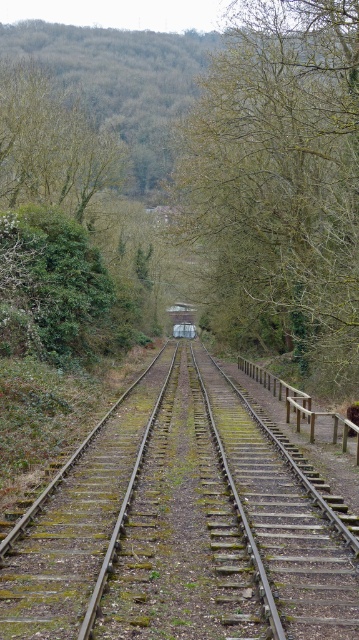
Is green leafy tree at center wider than metallic silver train at center?

Indeed, green leafy tree at center has a greater width compared to metallic silver train at center.

Does green leafy tree at center appear on the left side of metallic silver train at center?

No, green leafy tree at center is not to the left of metallic silver train at center.

Who is more distant from viewer, (309,310) or (193,312)?

Positioned behind is point (193,312).

This screenshot has width=359, height=640. What are the coordinates of `green leafy tree at center` in the screenshot? It's located at (278, 182).

The height and width of the screenshot is (640, 359). Identify the location of green leafy tree at center. (278, 182).

Can you confirm if green leafy tree at center is positioned to the left of green leafy tree at upper center?

Incorrect, green leafy tree at center is not on the left side of green leafy tree at upper center.

Find the location of a particular element. The image size is (359, 640). green leafy tree at center is located at coordinates 278,182.

Between green mossy metal track at center and green leafy tree at upper center, which one appears on the left side from the viewer's perspective?

green leafy tree at upper center is more to the left.

Does green mossy metal track at center have a lesser width compared to green leafy tree at upper center?

Correct, green mossy metal track at center's width is less than green leafy tree at upper center's.

Does point (281, 508) come in front of point (11, 124)?

Yes, point (281, 508) is in front of point (11, 124).

You are a GUI agent. You are given a task and a screenshot of the screen. Output one action in this format:
    pyautogui.click(x=<x>, y=<y>)
    Task: Click on the green mossy metal track at center
    The image size is (359, 640).
    Given the screenshot: What is the action you would take?
    pyautogui.click(x=179, y=529)